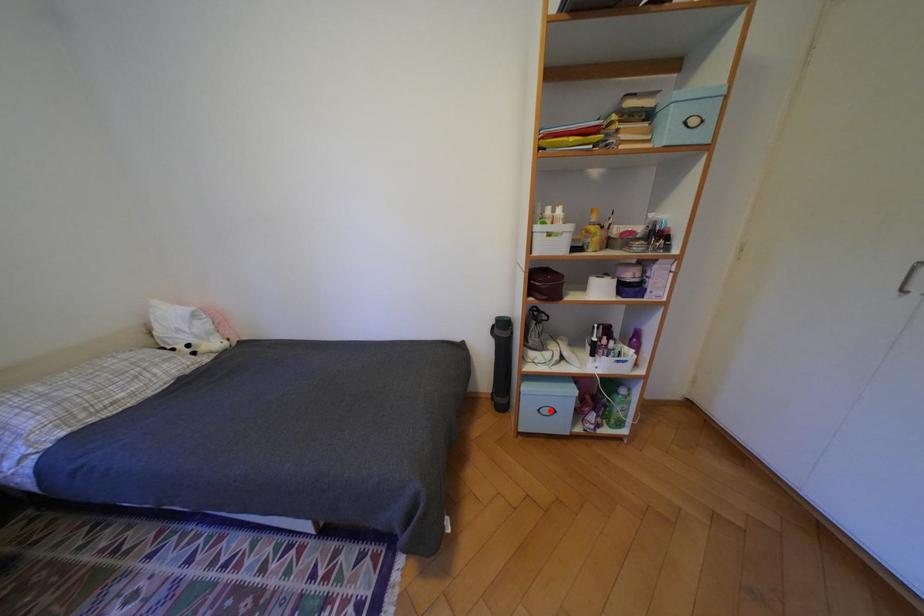
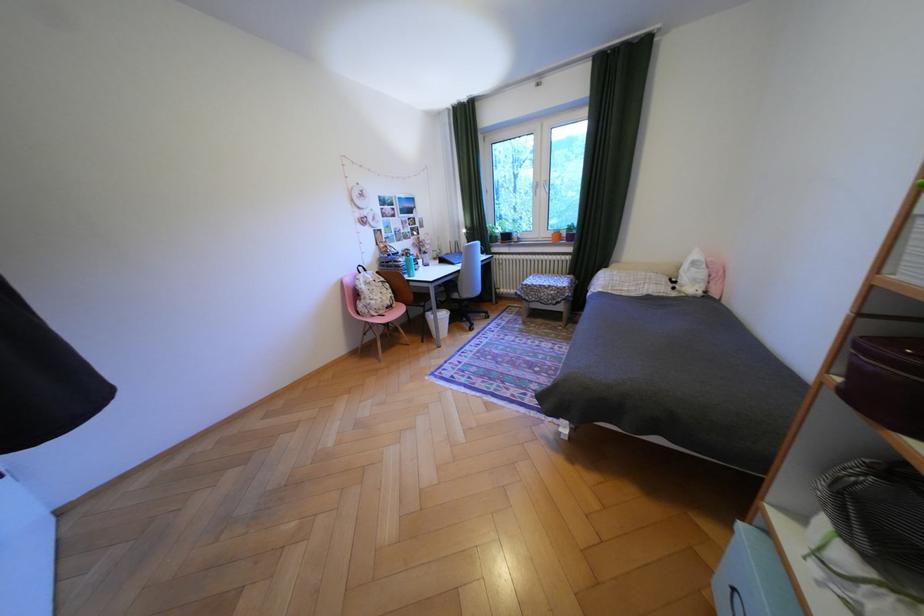
Locate, in the second image, the point that corresponds to the highlighted location in the first image.

(746, 591)